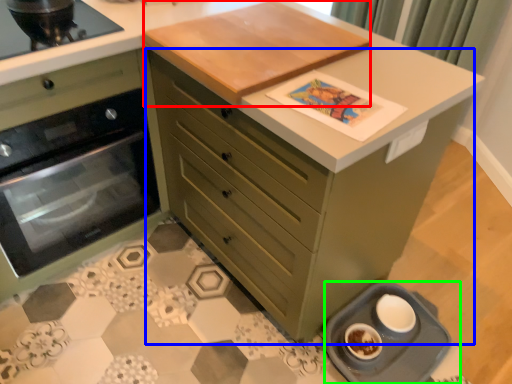
Question: Based on their relative distances, which object is nearer to table top (highlighted by a red box)? Choose from chest of drawers (highlighted by a blue box) and appliance (highlighted by a green box).

Choices:
 (A) chest of drawers
 (B) appliance

Answer: (A)